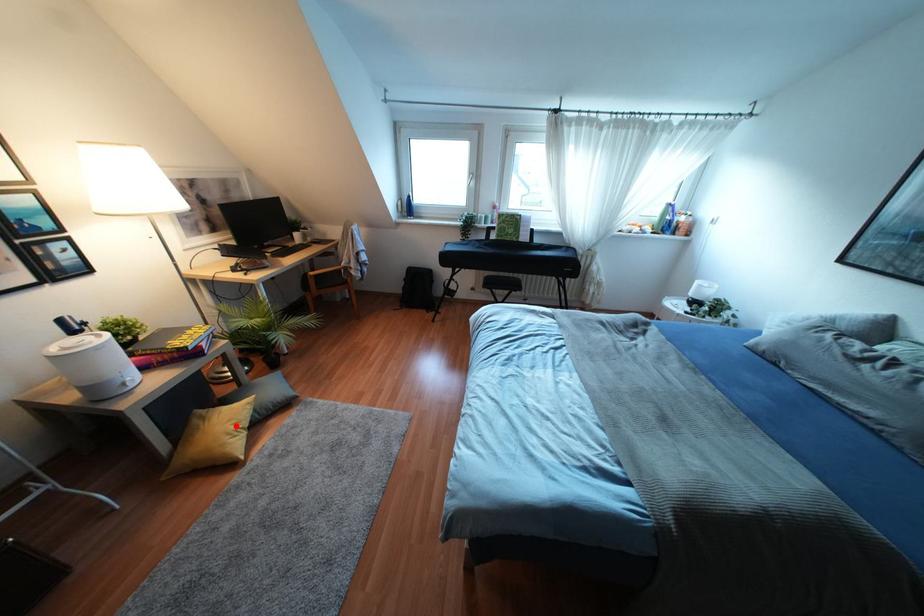
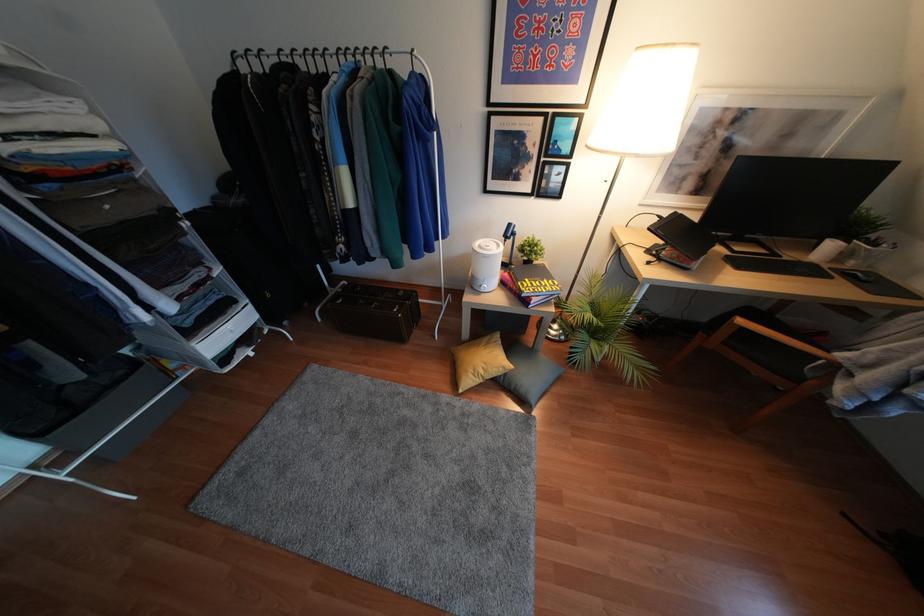
Question: I am providing you with two images of the same scene from different viewpoints. A red point is marked on the first image. Can you still see the location of the red point in image 2?

Choices:
 (A) Yes
 (B) No

Answer: (A)